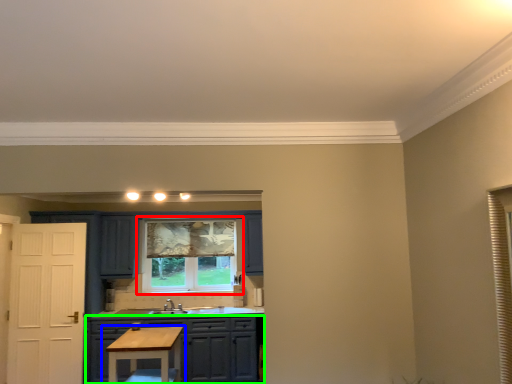
Question: Considering the real-world distances, which object is farthest from window (highlighted by a red box)? table (highlighted by a blue box) or cabinetry (highlighted by a green box)?

Choices:
 (A) table
 (B) cabinetry

Answer: (A)